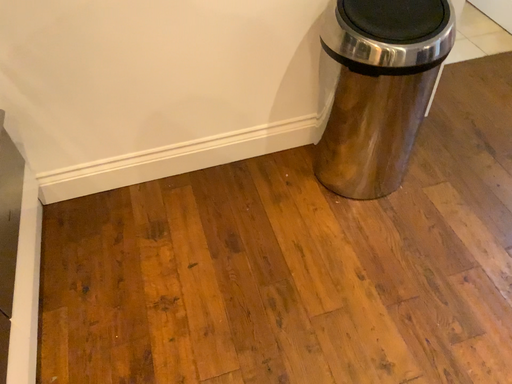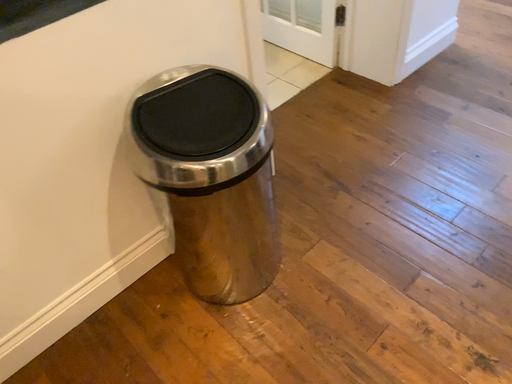
Question: How did the camera likely rotate when shooting the video?

Choices:
 (A) rotated upward
 (B) rotated downward

Answer: (A)